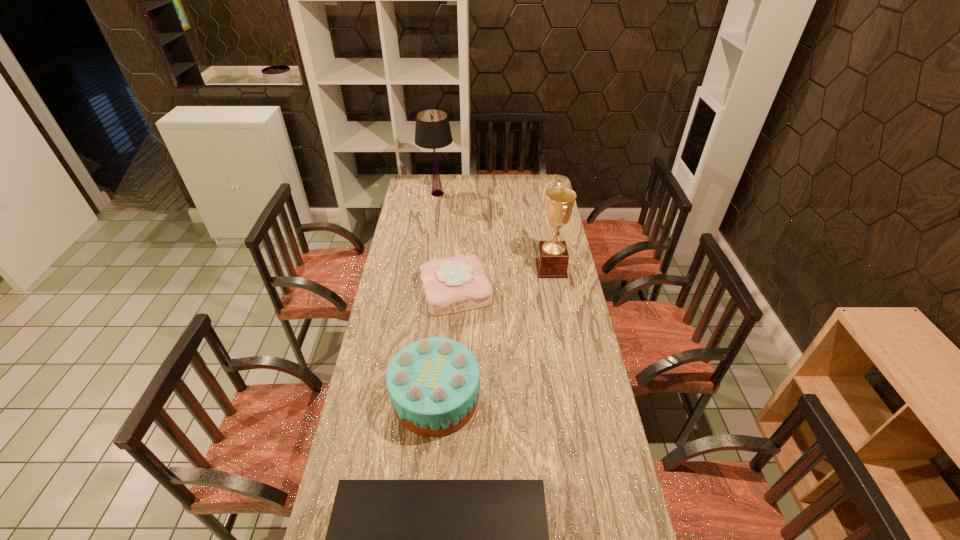
You are a GUI agent. You are given a task and a screenshot of the screen. Output one action in this format:
    pyautogui.click(x=<x>, y=<y>)
    Task: Click on the lampshade
    
    Given the screenshot: What is the action you would take?
    pyautogui.click(x=432, y=131)

You are a GUI agent. You are given a task and a screenshot of the screen. Output one action in this format:
    pyautogui.click(x=<x>, y=<y>)
    Task: Click on the trophy cup
    The image size is (960, 540).
    Given the screenshot: What is the action you would take?
    pyautogui.click(x=552, y=260)

Identify the location of the taller cake. This screenshot has height=540, width=960. (433, 383).

Where is `the nearer cake`? the nearer cake is located at coordinates (433, 383).

Locate an element on the screen. The height and width of the screenshot is (540, 960). the shorter cake is located at coordinates (454, 284).

Where is `vacant position located on the front-facing side of the farthest object`? The image size is (960, 540). vacant position located on the front-facing side of the farthest object is located at coordinates (511, 194).

I want to click on free space located on the plaque of the trophy cup, so click(498, 268).

Locate an element on the screen. vacant region located on the plaque of the trophy cup is located at coordinates (516, 268).

Find the location of a particular element. The image size is (960, 540). vacant space situated on the plaque of the trophy cup is located at coordinates (524, 268).

The width and height of the screenshot is (960, 540). I want to click on free space located 0.220m on the right of the fourth farthest object, so click(541, 399).